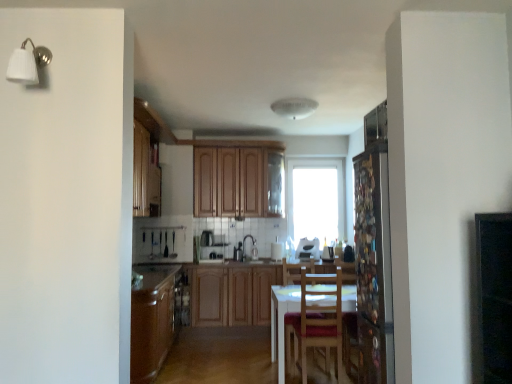
Question: From the image's perspective, is matte brown countertop at lower left located above or below wooden cabinets at center, placed as the first cabinetry when sorted from bottom to top?

Choices:
 (A) below
 (B) above

Answer: (B)

Question: Looking at their shapes, would you say matte brown countertop at lower left is wider or thinner than wooden cabinets at center, the second cabinetry positioned from the top?

Choices:
 (A) thin
 (B) wide

Answer: (A)

Question: Estimate the real-world distances between objects in this image. Which object is closer to the white glossy toaster at center, which is the 1th appliance from right to left?

Choices:
 (A) white glossy sink at center
 (B) transparent glass window at center
 (C) transparent glass screen door at right
 (D) wooden chair at center
 (E) white matte wall sconce at upper left

Answer: (B)

Question: Which is farther from the matte brown countertop at lower left?

Choices:
 (A) white matte wall sconce at upper left
 (B) wooden cabinets at center, placed as the first cabinetry when sorted from bottom to top
 (C) transparent glass window at center
 (D) wooden cabinets at center, the 1th cabinetry when ordered from top to bottom
 (E) matte white microwave at center, the second appliance in the right-to-left sequence

Answer: (C)